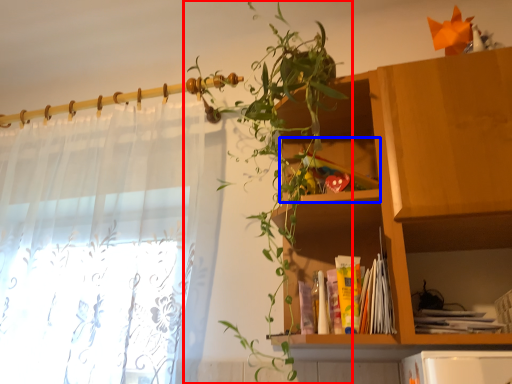
Question: Which object is closer to the camera taking this photo, houseplant (highlighted by a red box) or cabinet (highlighted by a blue box)?

Choices:
 (A) houseplant
 (B) cabinet

Answer: (A)